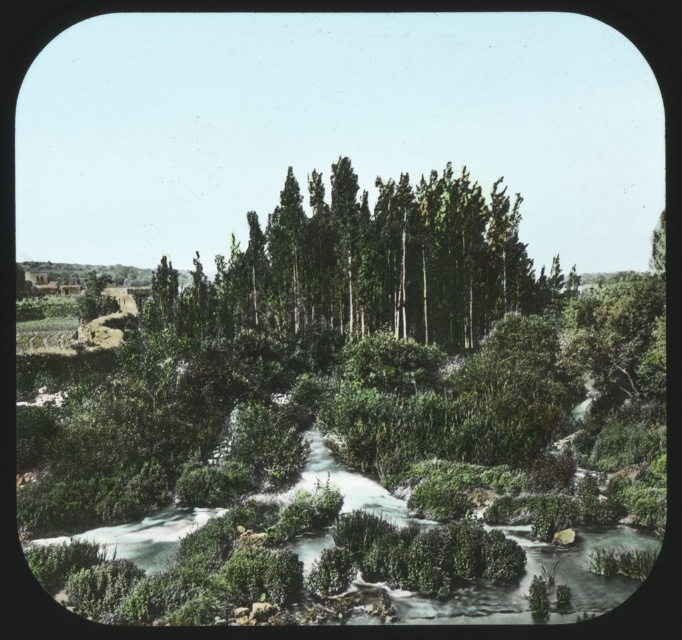
Measure the distance between green mossy river at center and camera.

A distance of 26.97 meters exists between green mossy river at center and camera.

Can you confirm if green mossy river at center is positioned to the left of green smooth trees at center?

Correct, you'll find green mossy river at center to the left of green smooth trees at center.

Who is more distant from viewer, (469, 525) or (267, 330)?

Point (267, 330)

Where is `green mossy river at center`? This screenshot has height=640, width=682. green mossy river at center is located at coordinates (342, 560).